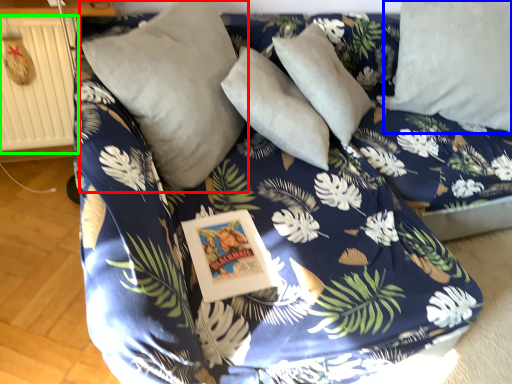
Question: Based on their relative distances, which object is farther from pillow (highlighted by a red box)? Choose from pillow (highlighted by a blue box) and radiator (highlighted by a green box).

Choices:
 (A) pillow
 (B) radiator

Answer: (A)